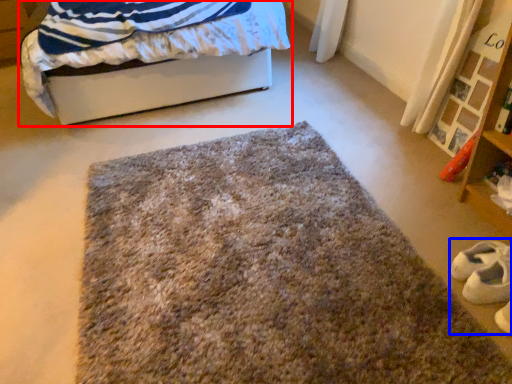
Question: Among these objects, which one is farthest to the camera, bed (highlighted by a red box) or shoe (highlighted by a blue box)?

Choices:
 (A) bed
 (B) shoe

Answer: (A)